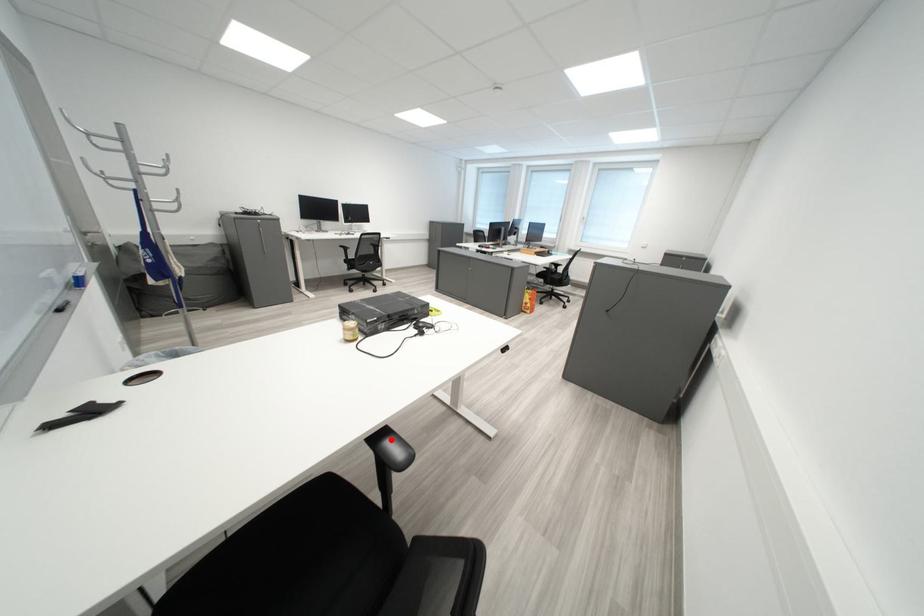
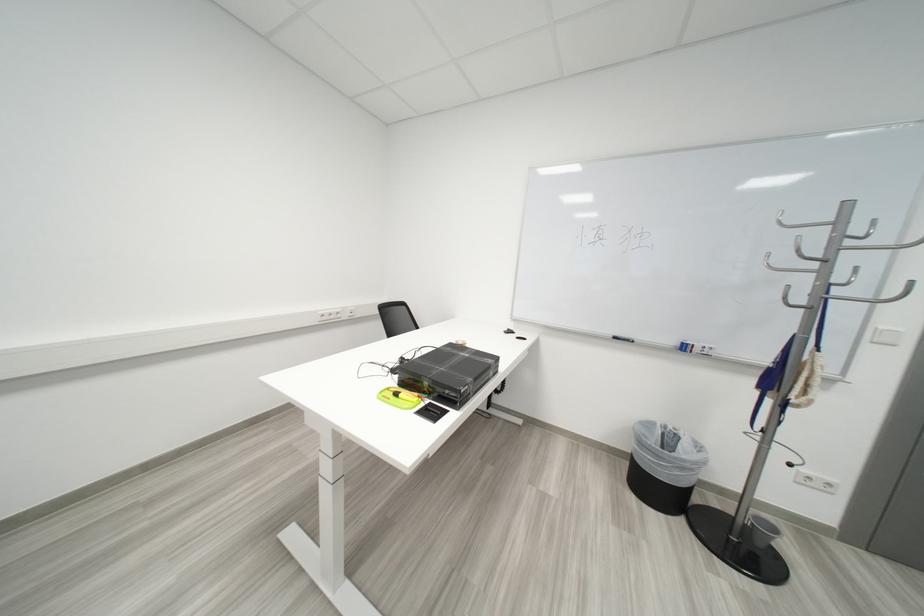
Question: I am providing you with two images of the same scene from different viewpoints. A red point is marked on the first image. Can you still see the location of the red point in image 2?

Choices:
 (A) Yes
 (B) No

Answer: (B)